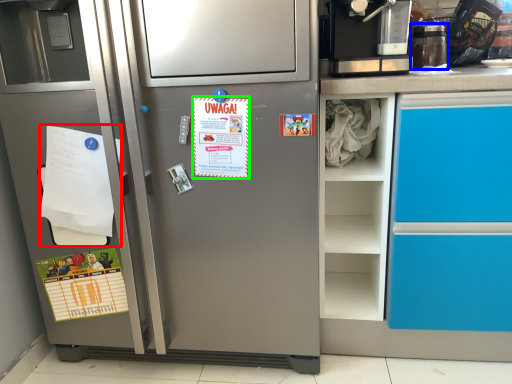
Question: Which object is the closest to the flyer (highlighted by a red box)? Choose among these: appliance (highlighted by a blue box) or postcard (highlighted by a green box).

Choices:
 (A) appliance
 (B) postcard

Answer: (B)